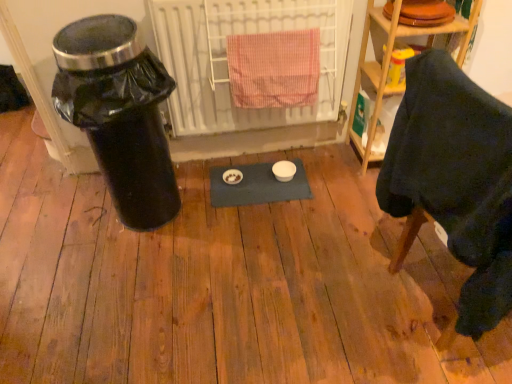
Where is `vacant space in front of black plastic trash can at left`? The image size is (512, 384). vacant space in front of black plastic trash can at left is located at coordinates (132, 271).